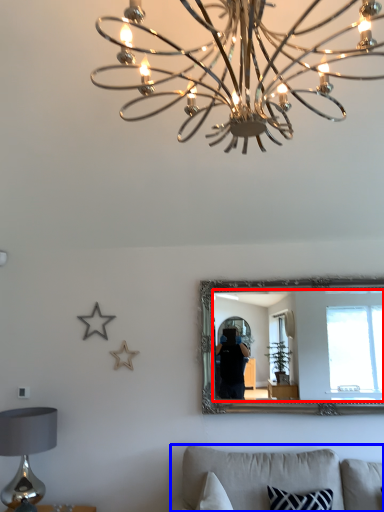
Question: Which object appears farthest to the camera in this image, mirror (highlighted by a red box) or furniture (highlighted by a blue box)?

Choices:
 (A) mirror
 (B) furniture

Answer: (A)